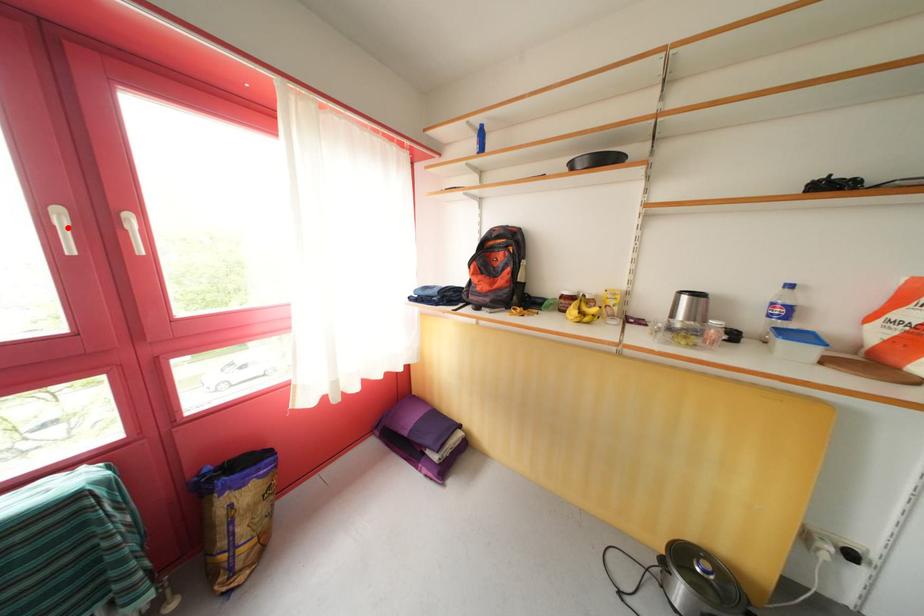
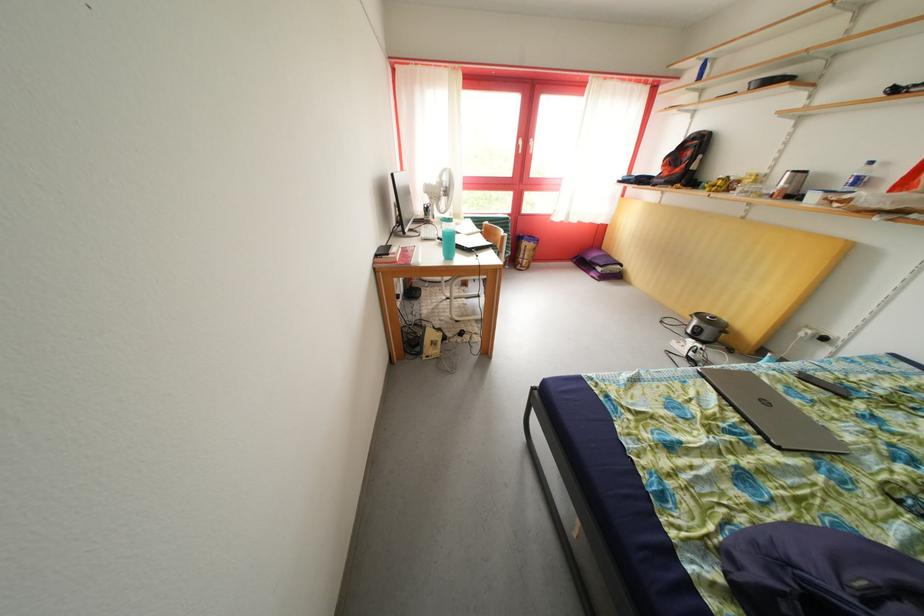
Question: I am providing you with two images of the same scene from different viewpoints. In image1, a red point is highlighted. Considering the same 3D point in image2, which of the following is correct?

Choices:
 (A) It is closer
 (B) It is farther

Answer: (A)